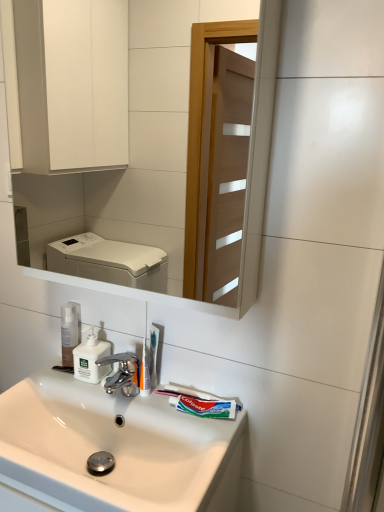
The width and height of the screenshot is (384, 512). What are the coordinates of `vacant space situated on the left part of green matte toothpaste at lower center` in the screenshot? It's located at (152, 406).